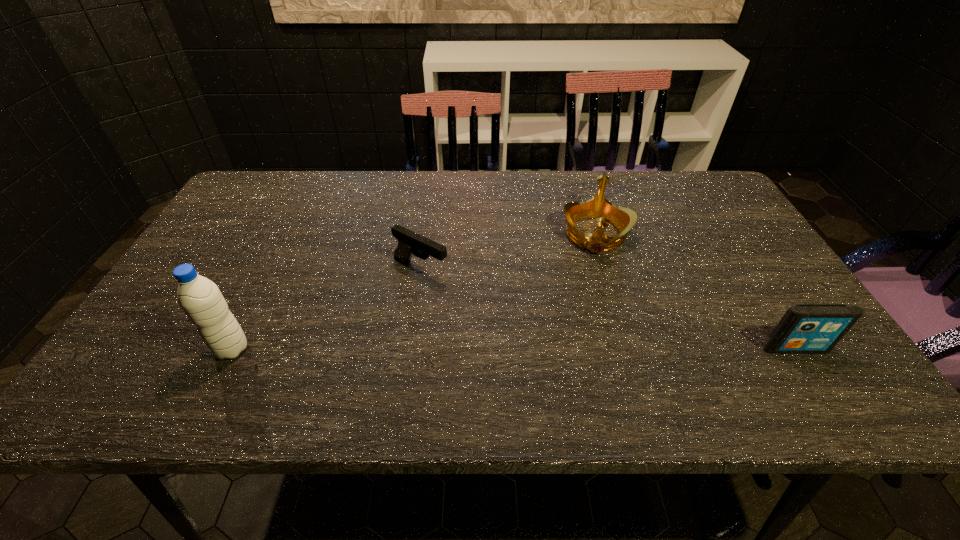
In the image, there is a desktop. At what (x,y) coordinates should I click in order to perform the action: click on blank space at the left edge. Please return your answer as a coordinate pair (x, y). This screenshot has height=540, width=960. Looking at the image, I should click on (172, 328).

Find the location of a particular element. The image size is (960, 540). vacant region at the right edge of the desktop is located at coordinates point(742,260).

Locate an element on the screen. This screenshot has width=960, height=540. blank space at the far left corner of the desktop is located at coordinates (285, 178).

This screenshot has height=540, width=960. Identify the location of free space at the far right corner of the desktop. (724, 194).

Where is `empty space between the rightmost object and the leftmost object`? Image resolution: width=960 pixels, height=540 pixels. empty space between the rightmost object and the leftmost object is located at coordinates (514, 349).

Find the location of `blank region between the iPod and the second object from left to right`. blank region between the iPod and the second object from left to right is located at coordinates (608, 309).

Image resolution: width=960 pixels, height=540 pixels. I want to click on free space between the water bottle and the shortest object, so click(x=326, y=309).

Locate an element on the screen. This screenshot has height=540, width=960. vacant area between the water bottle and the pistol is located at coordinates (326, 309).

Locate an element on the screen. free space between the tiara and the rightmost object is located at coordinates (695, 292).

At what (x,y) coordinates should I click in order to perform the action: click on vacant space that is in between the tallest object and the iPod. Please return your answer as a coordinate pair (x, y). The width and height of the screenshot is (960, 540). Looking at the image, I should click on (514, 349).